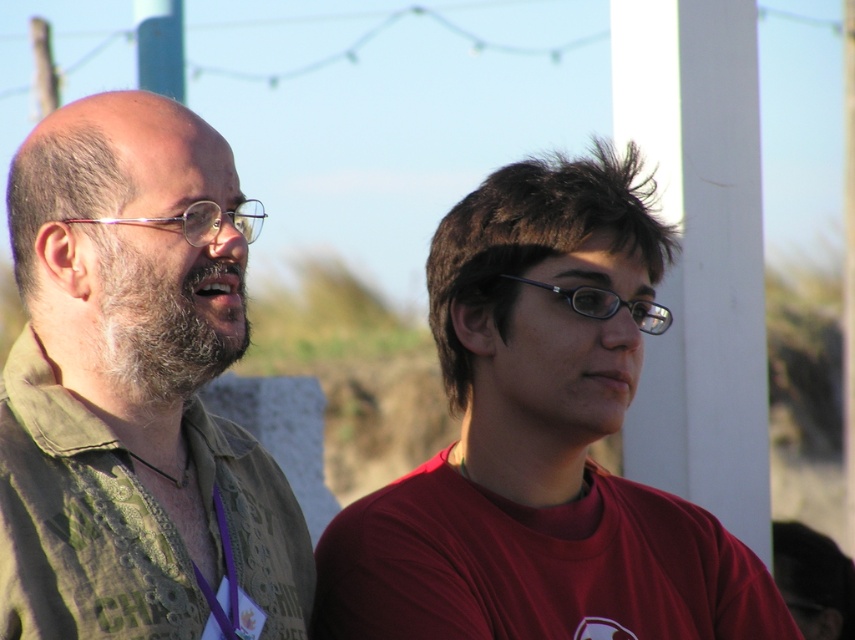
Is matte red shirt at center bigger than green textured shirt at left?

Indeed, matte red shirt at center has a larger size compared to green textured shirt at left.

Is matte red shirt at center positioned in front of green textured shirt at left?

No, it is not.

Does point (557, 272) come closer to viewer compared to point (192, 468)?

That is False.

Where is `matte red shirt at center`? The width and height of the screenshot is (855, 640). matte red shirt at center is located at coordinates (540, 442).

Consider the image. Between green textured shirt at left and beardfluffy/softman's face at left, which one appears on the right side from the viewer's perspective?

From the viewer's perspective, beardfluffy/softman's face at left appears more on the right side.

Where is `green textured shirt at left`? green textured shirt at left is located at coordinates (131, 387).

Where is `matte red shirt at center`? The image size is (855, 640). matte red shirt at center is located at coordinates (540, 442).

Locate an element on the screen. The height and width of the screenshot is (640, 855). matte red shirt at center is located at coordinates (540, 442).